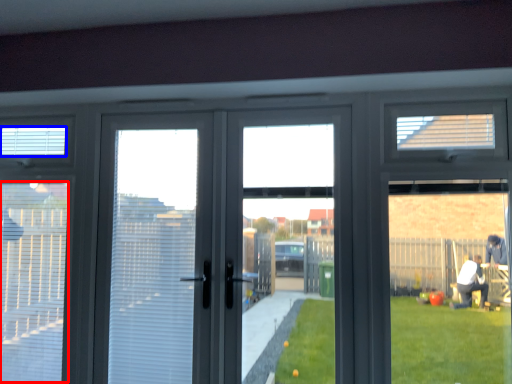
Question: Which point is closer to the camera, blind (highlighted by a red box) or blind (highlighted by a blue box)?

Choices:
 (A) blind
 (B) blind

Answer: (A)